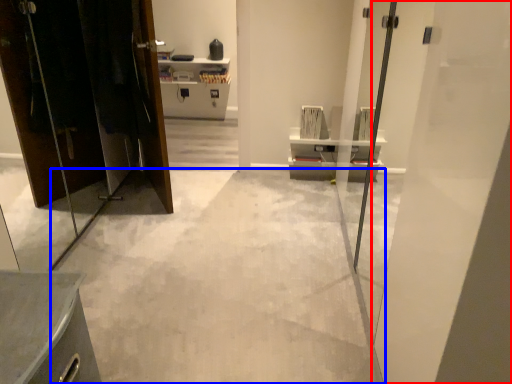
Question: Which point is closer to the camera, door (highlighted by a red box) or concrete (highlighted by a blue box)?

Choices:
 (A) door
 (B) concrete

Answer: (A)